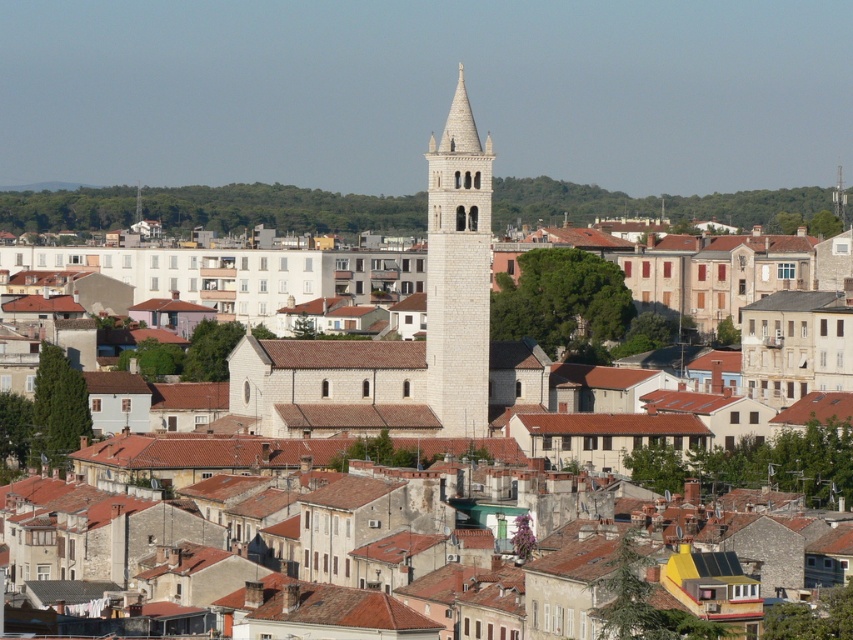
You are an architect visiting the historic town and want to compare the sizes of the two prominent structures in the scene. Which one is bigger between the white stone church at center and the white stone bell tower at center?

The white stone church at center is larger in size than the white stone bell tower at center.

You are standing in the historic town and want to take a photo of the white stone church at center. If your camera can focus on objects up to 400 feet away, will you need to move closer to get a clear shot?

The white stone church at center is 443.65 feet from the viewer, which is beyond the camera focus range of 400 feet. Therefore, you need to move closer to ensure the church is in focus.

You are standing at the point labeled as point (457,272) in the image. What is the closest building to you?

The point (457,272) corresponds to the white stone bell tower at center, so the closest building to you is the white stone bell tower at center.